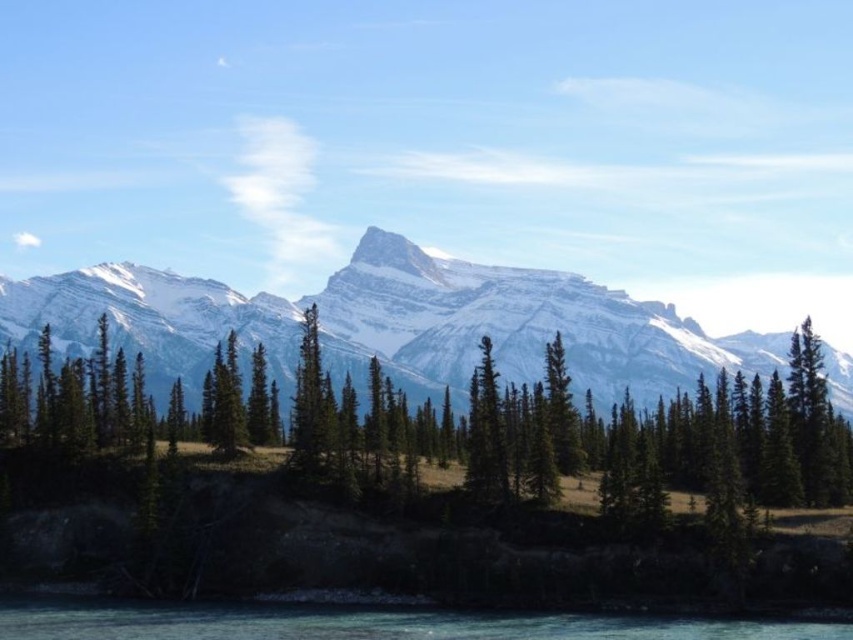
You are standing at the point with coordinates (685, 440) in the mountainous landscape. What object is exactly at this location?

The green textured pine trees at center are located exactly at point (685, 440).

You are a hiker standing at the edge of the meadow looking towards the mountain. You see the green textured pine trees at center and the clear blue water at lower center. Which object is closer to you?

The green textured pine trees at center are closer to you because the clear blue water at lower center is behind them.

Based on the scene description, where is the snowy granite mountain range at center located in terms of its 2D coordinates?

The snowy granite mountain range at center is located at the 2D coordinates of point (x=392, y=323).